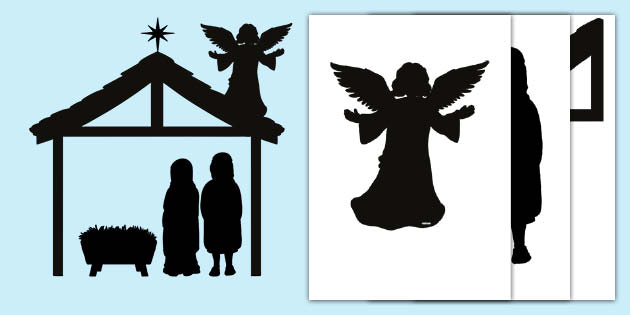
At what (x,y) coordinates should I click in order to perform the action: click on black silhouette picture of child angel. Please return your answer as a coordinate pair (x, y). This screenshot has height=315, width=630. Looking at the image, I should click on (409, 119).